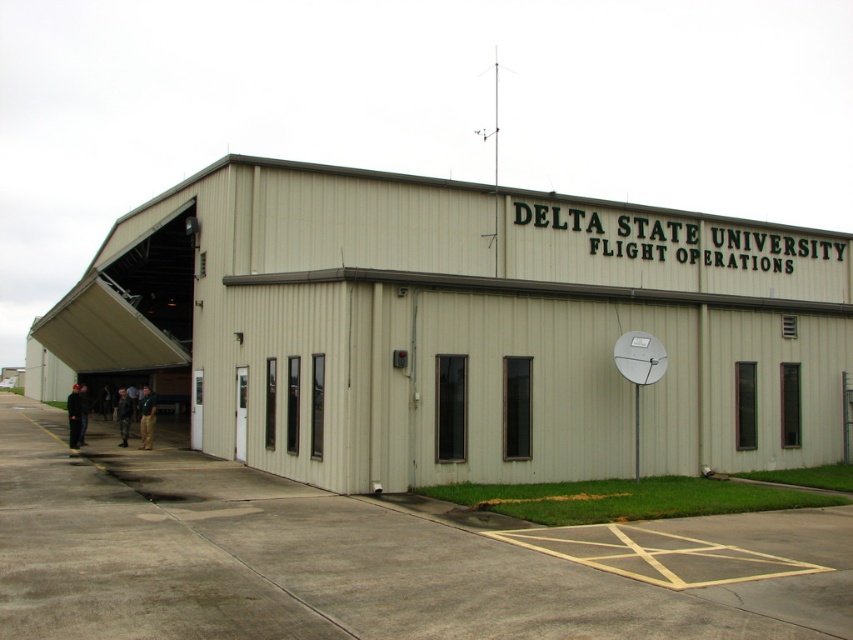
You are a maintenance worker needing to access the white metallic satellite dish at upper right located on the exterior wall of the beige corrugated metal hangar at center. Based on the scene, can you reach the satellite dish without climbing onto the hangar roof?

The beige corrugated metal hangar at center is in front of the white metallic satellite dish at upper right, meaning the satellite dish is positioned behind the hangar. Therefore, you would need to go around to the back side of the beige corrugated metal hangar at center to access the satellite dish without climbing onto the roof.

You are a drone operator planning to land a drone near the beige corrugated metal hangar at center and the white metallic satellite dish at upper right. Based on their positions, which object should you avoid flying over to stay clear of the other?

Result: You should avoid flying over the white metallic satellite dish at upper right because the beige corrugated metal hangar at center is above it, so flying over the satellite dish might bring the drone into the hangar area.

In the scene shown: A drone is flying at a point [287,362] relative to the building. The drone needs to land on the roof, which is 16.60 meters away from its current position. Is the drone within the safe landing distance of 20 meters?

The drone is at point [287,362] and needs to land on the roof 16.60 meters away. Since 16.60 meters is less than the 20 meters safe distance, the drone is within the safe landing distance.